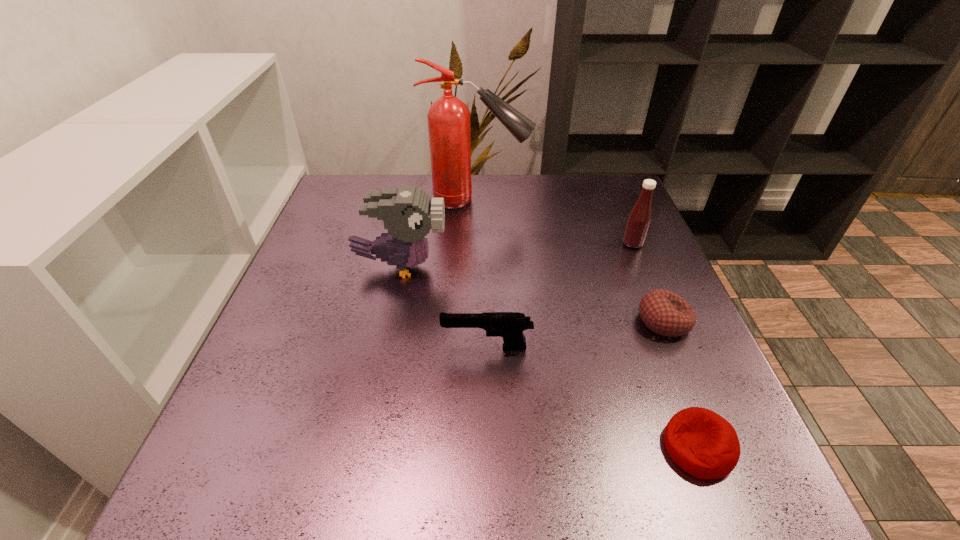
Locate an element on the screen. This screenshot has height=540, width=960. free spot between the farther beanbag and the third farthest object is located at coordinates (533, 294).

The image size is (960, 540). I want to click on free area in between the farthest object and the nearest object, so click(588, 324).

Identify the location of free space that is in between the pistol and the fourth nearest object. The width and height of the screenshot is (960, 540). (444, 307).

Locate an element on the screen. vacant area between the third shortest object and the nearest object is located at coordinates (592, 397).

This screenshot has width=960, height=540. I want to click on free space between the tallest object and the nearest object, so click(x=588, y=324).

Where is `vacant space that's between the fourth nearest object and the pistol`? This screenshot has width=960, height=540. vacant space that's between the fourth nearest object and the pistol is located at coordinates (444, 307).

Image resolution: width=960 pixels, height=540 pixels. I want to click on vacant space that is in between the bird and the Tabasco sauce, so click(x=516, y=255).

Where is `blank region between the fourth tallest object and the fourth nearest object`? The width and height of the screenshot is (960, 540). blank region between the fourth tallest object and the fourth nearest object is located at coordinates (444, 307).

Identify which object is the third nearest to the fourth nearest object. Please provide its 2D coordinates. Your answer should be formatted as a tuple, i.e. [(x, y)], where the tuple contains the x and y coordinates of a point satisfying the conditions above.

[(665, 313)]

Where is `the closest object to the Tabasco sauce`? This screenshot has height=540, width=960. the closest object to the Tabasco sauce is located at coordinates (665, 313).